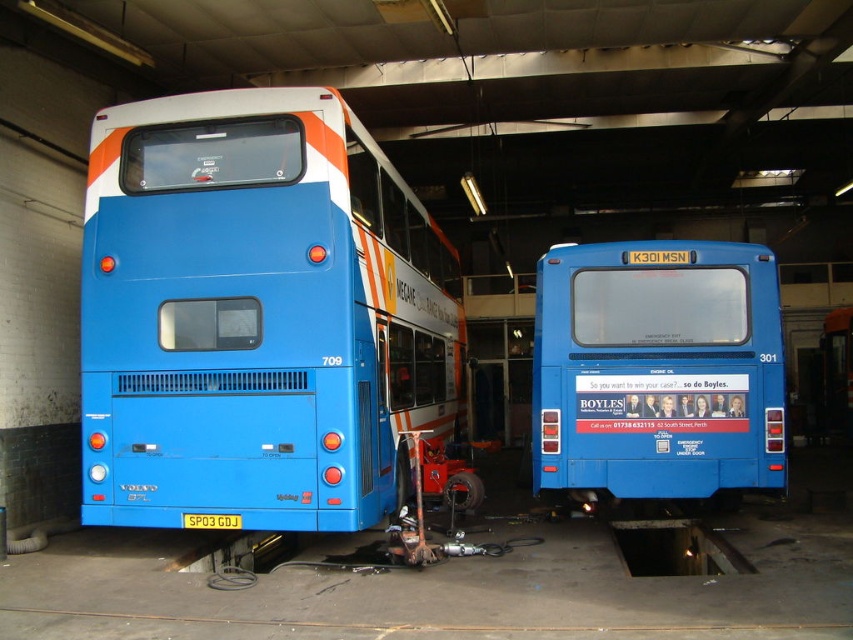
Is blue matte bus at left to the right of blue matte bus at center from the viewer's perspective?

In fact, blue matte bus at left is to the left of blue matte bus at center.

Between blue matte bus at left and blue matte bus at center, which one is positioned lower?

blue matte bus at center is below.

The width and height of the screenshot is (853, 640). What do you see at coordinates (257, 316) in the screenshot?
I see `blue matte bus at left` at bounding box center [257, 316].

Find the location of a particular element. blue matte bus at left is located at coordinates (257, 316).